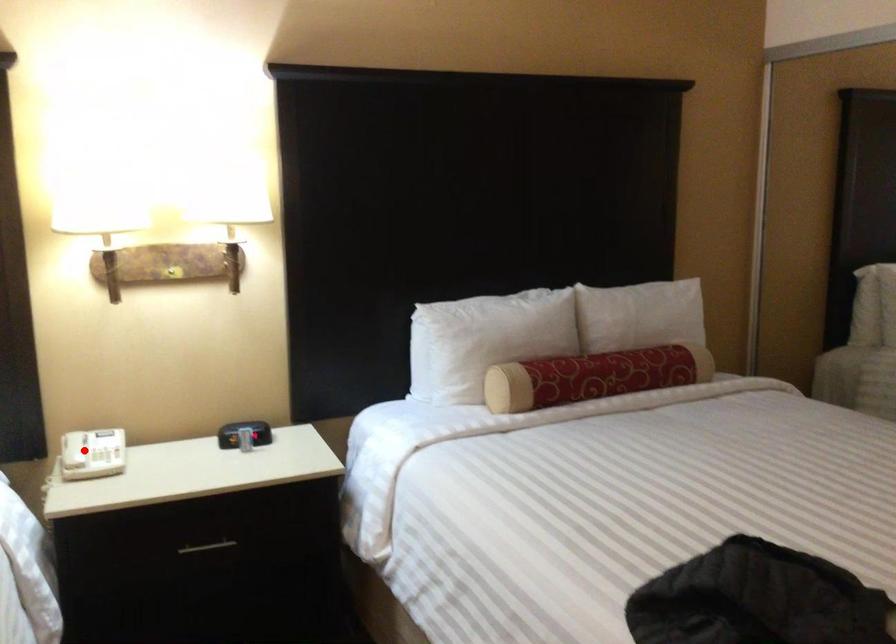
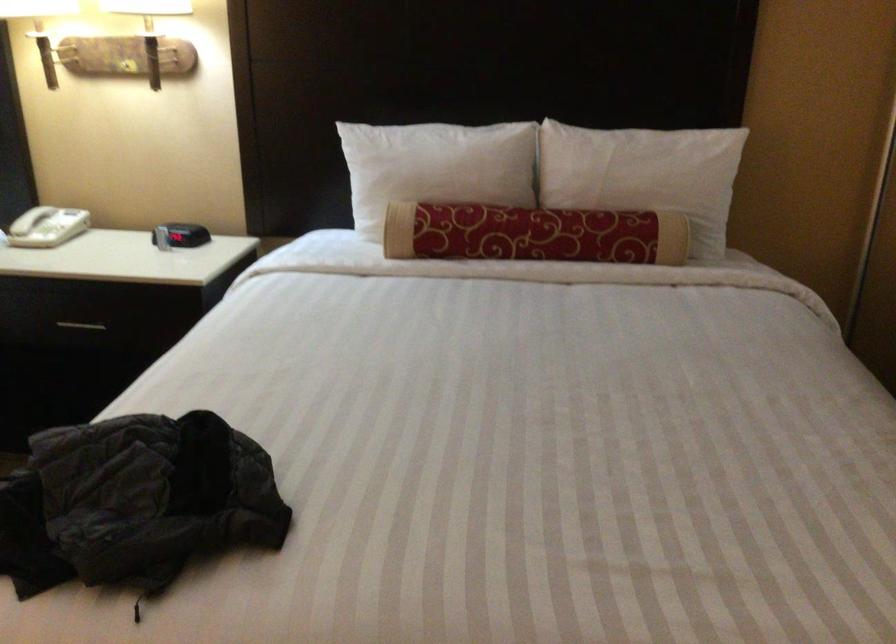
In the second image, find the point that corresponds to the highlighted location in the first image.

(30, 220)